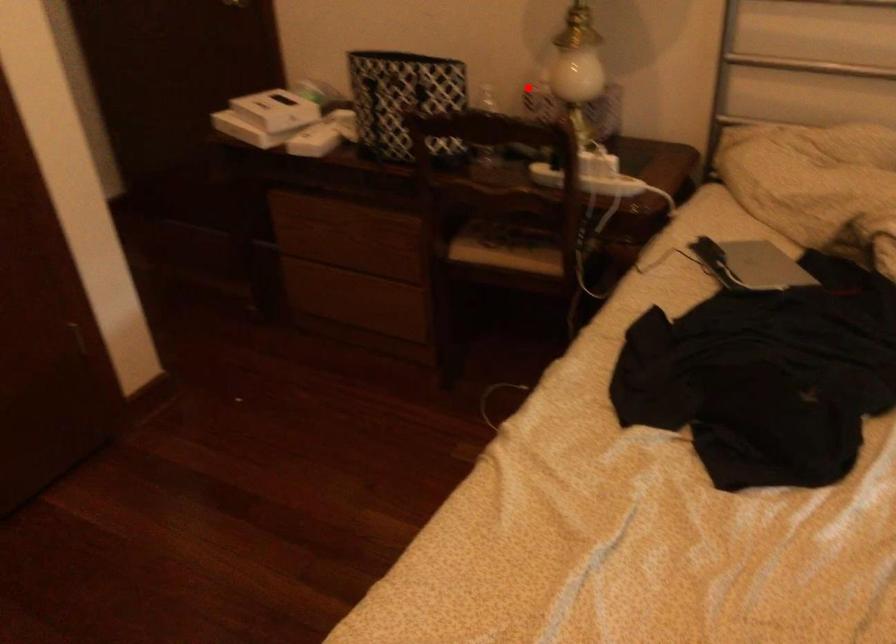
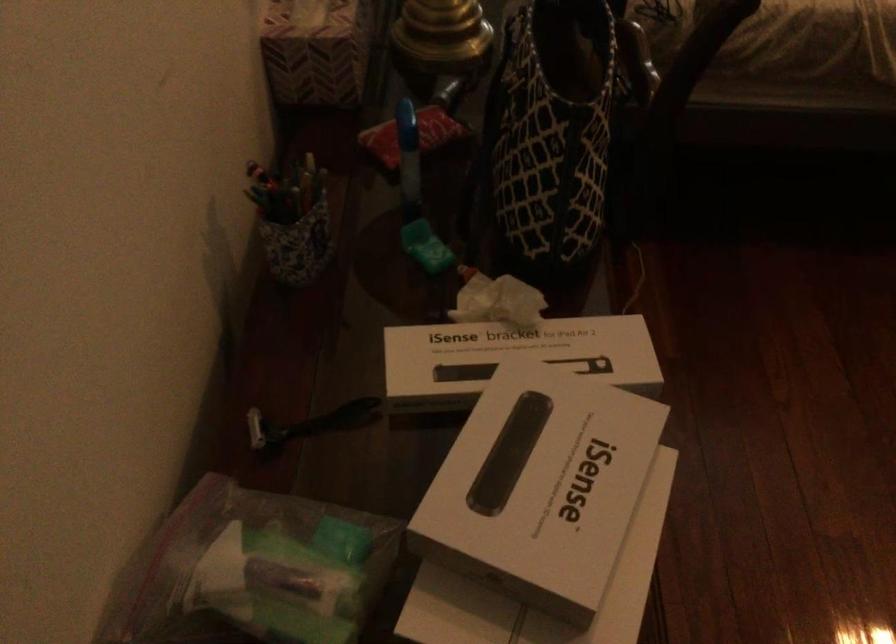
Question: I am providing you with two images of the same scene from different viewpoints. A red point is shown in image1. For the corresponding object point in image2, is it positioned nearer or farther from the camera?

Choices:
 (A) Nearer
 (B) Farther

Answer: (A)